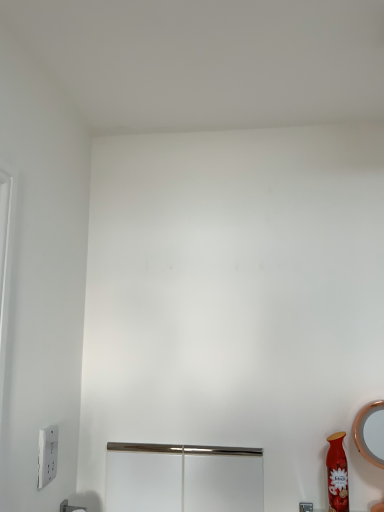
Question: Considering the positions of matte red vase at lower right and white plastic light switch at lower left in the image, is matte red vase at lower right taller or shorter than white plastic light switch at lower left?

Choices:
 (A) tall
 (B) short

Answer: (A)

Question: Considering their positions, is matte red vase at lower right located in front of or behind white plastic light switch at lower left?

Choices:
 (A) behind
 (B) front

Answer: (A)

Question: Which object is the closest to the white plastic light switch at lower left?

Choices:
 (A) polished metal screen door at center
 (B) matte red vase at lower right

Answer: (A)

Question: Estimate the real-world distances between objects in this image. Which object is farther from the white plastic light switch at lower left?

Choices:
 (A) polished metal screen door at center
 (B) matte red vase at lower right

Answer: (B)